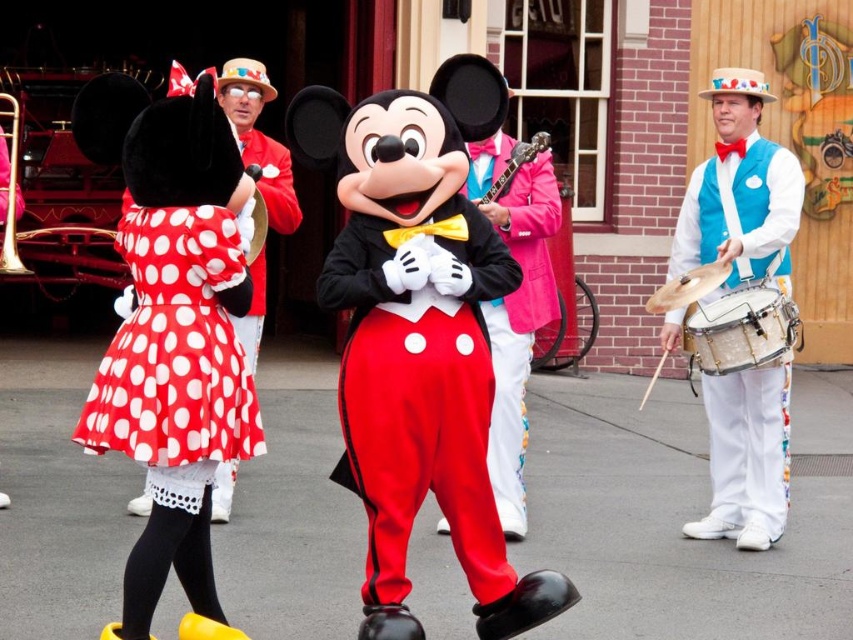
Does blue velvet vest at right have a lesser width compared to shiny silver cymbal at right?

In fact, blue velvet vest at right might be wider than shiny silver cymbal at right.

Who is more distant from viewer, (776, 166) or (646, 307)?

Positioned behind is point (646, 307).

You are a GUI agent. You are given a task and a screenshot of the screen. Output one action in this format:
    pyautogui.click(x=<x>, y=<y>)
    Task: Click on the blue velvet vest at right
    
    Given the screenshot: What is the action you would take?
    [740, 212]

Which of these two, white leather drum at right or shiny silver cymbal at right, stands shorter?

With less height is shiny silver cymbal at right.

Is point (772, 346) closer to camera compared to point (669, 298)?

Yes, it is in front of point (669, 298).

Identify the location of white leather drum at right. (741, 330).

This screenshot has width=853, height=640. What are the coordinates of `white leather drum at right` in the screenshot? It's located at (741, 330).

Is matte black bow tie at center positioned at the back of glossy wood guitar at center?

No.

Is point (534, 289) closer to camera compared to point (473, 198)?

That is True.

Find the location of a particular element. This screenshot has height=640, width=853. matte black bow tie at center is located at coordinates (514, 301).